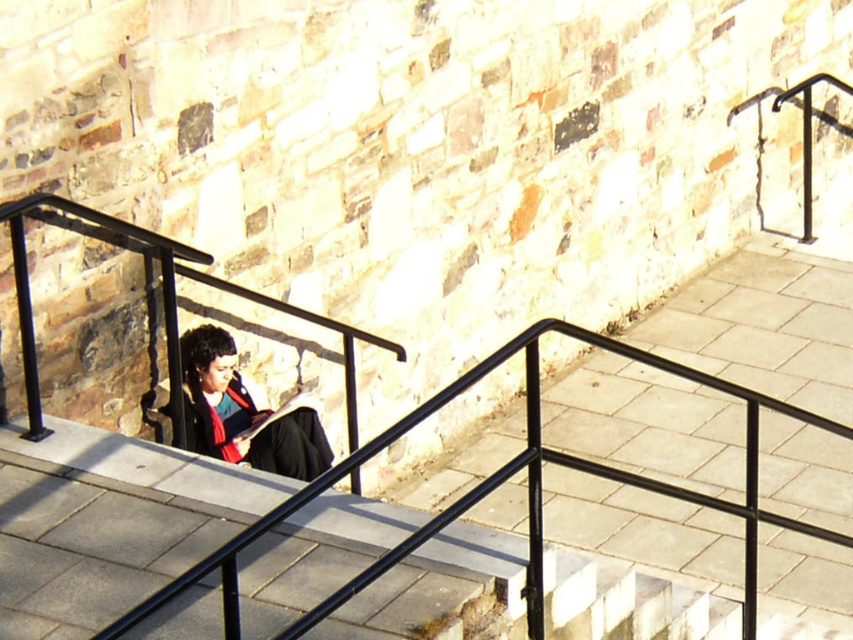
Question: Among these objects, which one is nearest to the camera?

Choices:
 (A) matte black jacket at center
 (B) black metal railing at center

Answer: (B)

Question: Does black metal railing at center come behind matte black jacket at center?

Choices:
 (A) yes
 (B) no

Answer: (B)

Question: Does black metal railing at center lie in front of matte black jacket at center?

Choices:
 (A) yes
 (B) no

Answer: (A)

Question: Can you confirm if black metal railing at center is bigger than matte black jacket at center?

Choices:
 (A) no
 (B) yes

Answer: (B)

Question: Which object is closer to the camera taking this photo?

Choices:
 (A) matte black jacket at center
 (B) black metal railing at center

Answer: (B)